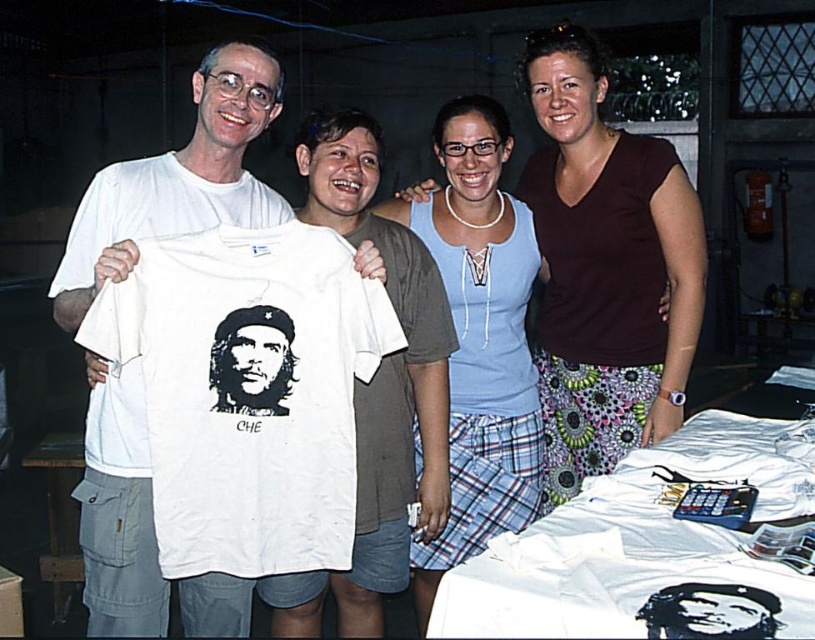
Measure the distance between white cotton t-shirt at center and camera.

white cotton t-shirt at center and camera are 5.61 feet apart.

Measure the distance from white cotton t-shirt at center to matte blue tank top at center.

They are 1.06 meters apart.

What are the coordinates of `white cotton t-shirt at center` in the screenshot? It's located at pyautogui.click(x=249, y=392).